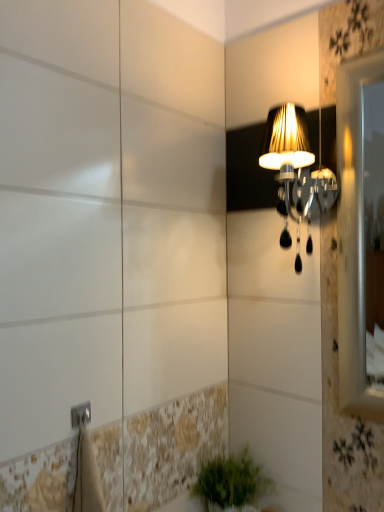
Question: Is green leafy plant at lower center outside matte black lampshade at upper right?

Choices:
 (A) no
 (B) yes

Answer: (B)

Question: From the image's perspective, does green leafy plant at lower center appear higher than matte black lampshade at upper right?

Choices:
 (A) no
 (B) yes

Answer: (A)

Question: Is green leafy plant at lower center further to the viewer compared to matte black lampshade at upper right?

Choices:
 (A) yes
 (B) no

Answer: (A)

Question: Is green leafy plant at lower center thinner than matte black lampshade at upper right?

Choices:
 (A) yes
 (B) no

Answer: (A)

Question: Considering the relative sizes of green leafy plant at lower center and matte black lampshade at upper right in the image provided, is green leafy plant at lower center taller than matte black lampshade at upper right?

Choices:
 (A) yes
 (B) no

Answer: (B)

Question: Would you consider green leafy plant at lower center to be distant from matte black lampshade at upper right?

Choices:
 (A) no
 (B) yes

Answer: (A)

Question: Are matte black lampshade at upper right and green leafy plant at lower center making contact?

Choices:
 (A) yes
 (B) no

Answer: (B)

Question: Can you confirm if matte black lampshade at upper right is smaller than green leafy plant at lower center?

Choices:
 (A) no
 (B) yes

Answer: (A)

Question: Is matte black lampshade at upper right positioned before green leafy plant at lower center?

Choices:
 (A) no
 (B) yes

Answer: (B)

Question: Would you consider matte black lampshade at upper right to be distant from green leafy plant at lower center?

Choices:
 (A) no
 (B) yes

Answer: (A)

Question: Is matte black lampshade at upper right to the right of green leafy plant at lower center from the viewer's perspective?

Choices:
 (A) no
 (B) yes

Answer: (B)

Question: From a real-world perspective, is matte black lampshade at upper right under green leafy plant at lower center?

Choices:
 (A) no
 (B) yes

Answer: (A)

Question: Is matte black lampshade at upper right in front of or behind green leafy plant at lower center in the image?

Choices:
 (A) front
 (B) behind

Answer: (A)